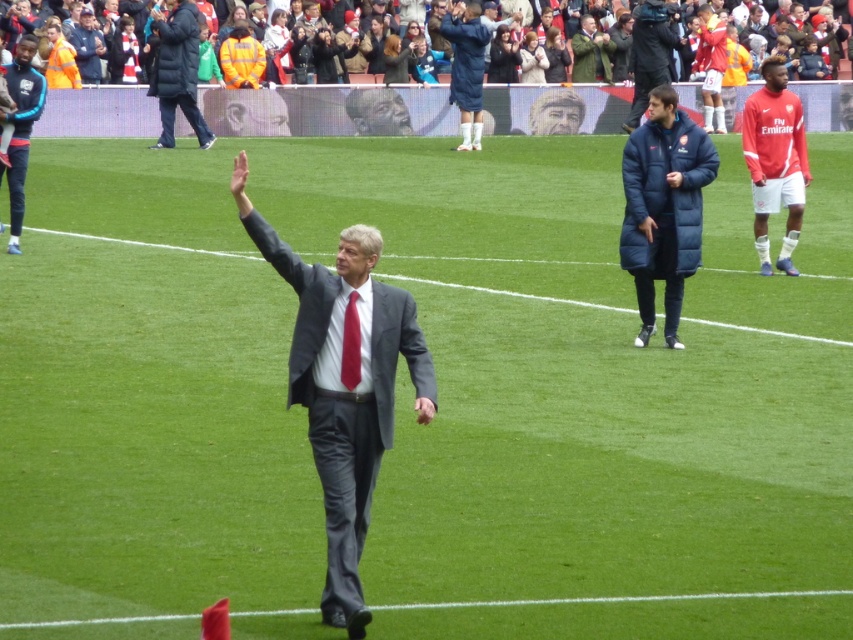
Does point (329, 332) come farther from viewer compared to point (24, 77)?

No, (329, 332) is in front of (24, 77).

Between point (415, 314) and point (16, 72), which one is positioned behind?

Point (16, 72)

Image resolution: width=853 pixels, height=640 pixels. What are the coordinates of `shiny gray suit at center` in the screenshot? It's located at (344, 384).

Is dark blue puffer jacket at upper left below blue synthetic jacket at left?

No, dark blue puffer jacket at upper left is not below blue synthetic jacket at left.

Is dark blue puffer jacket at upper left to the left of blue synthetic jacket at left from the viewer's perspective?

Correct, you'll find dark blue puffer jacket at upper left to the left of blue synthetic jacket at left.

You are a GUI agent. You are given a task and a screenshot of the screen. Output one action in this format:
    pyautogui.click(x=<x>, y=<y>)
    Task: Click on the dark blue puffer jacket at upper left
    
    Given the screenshot: What is the action you would take?
    [177, 72]

Is blue synthetic jacket at left below smooth gray suit at center?

Correct, blue synthetic jacket at left is located below smooth gray suit at center.

Which is above, blue synthetic jacket at left or smooth gray suit at center?

smooth gray suit at center

Does point (15, 208) come in front of point (368, 131)?

Yes, point (15, 208) is in front of point (368, 131).

Find the location of a particular element. This screenshot has width=853, height=640. blue synthetic jacket at left is located at coordinates (20, 128).